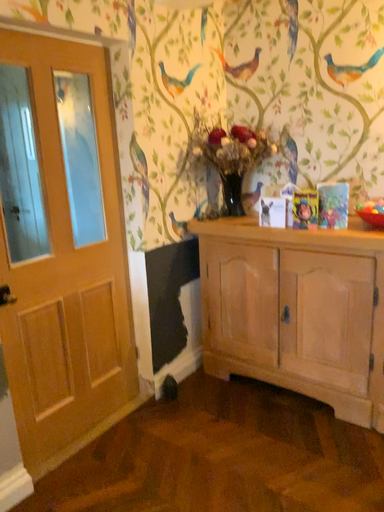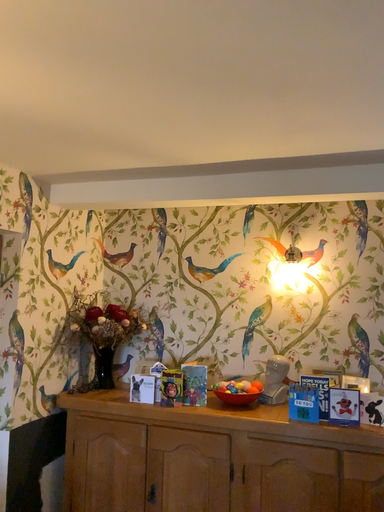
Question: Which way did the camera rotate in the video?

Choices:
 (A) rotated right
 (B) rotated left

Answer: (A)